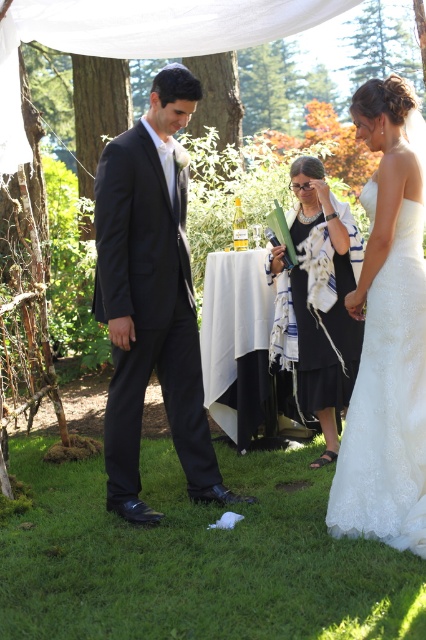
Which is more to the left, matte black suit at center or shiny black suit at center?

shiny black suit at center

This screenshot has width=426, height=640. I want to click on matte black suit at center, so click(386, 336).

Who is shorter, matte black suit at center or white textured shawl at center?

With less height is white textured shawl at center.

Can you confirm if matte black suit at center is wider than white textured shawl at center?

Incorrect, matte black suit at center's width does not surpass white textured shawl at center's.

I want to click on matte black suit at center, so click(x=386, y=336).

Can you confirm if shiny black suit at center is wider than white textured shawl at center?

Yes, shiny black suit at center is wider than white textured shawl at center.

Which is more to the left, shiny black suit at center or white textured shawl at center?

shiny black suit at center

Is point (129, 292) positioned before point (324, 262)?

That is True.

Where is `shiny black suit at center`? shiny black suit at center is located at coordinates (152, 298).